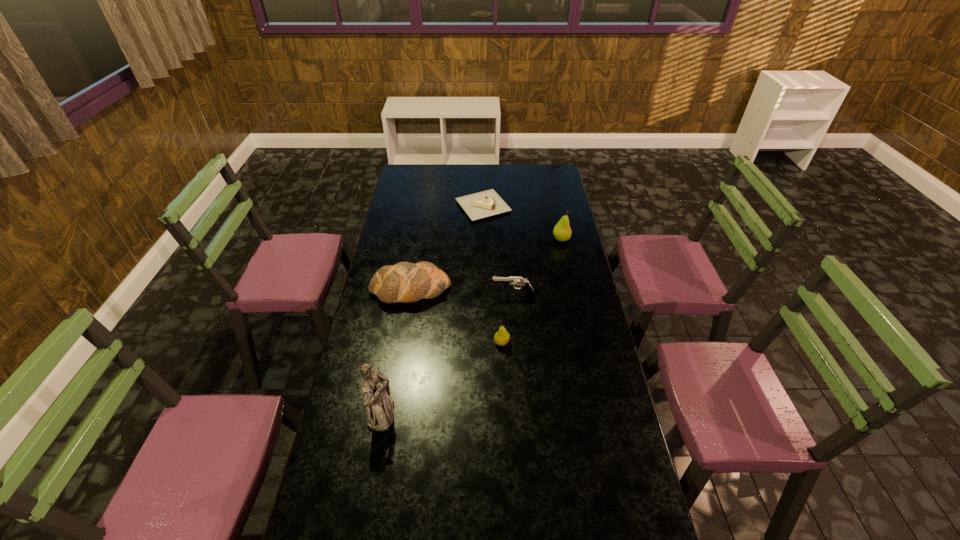
Identify the location of vacant place for an extra pear on the left. (397, 524).